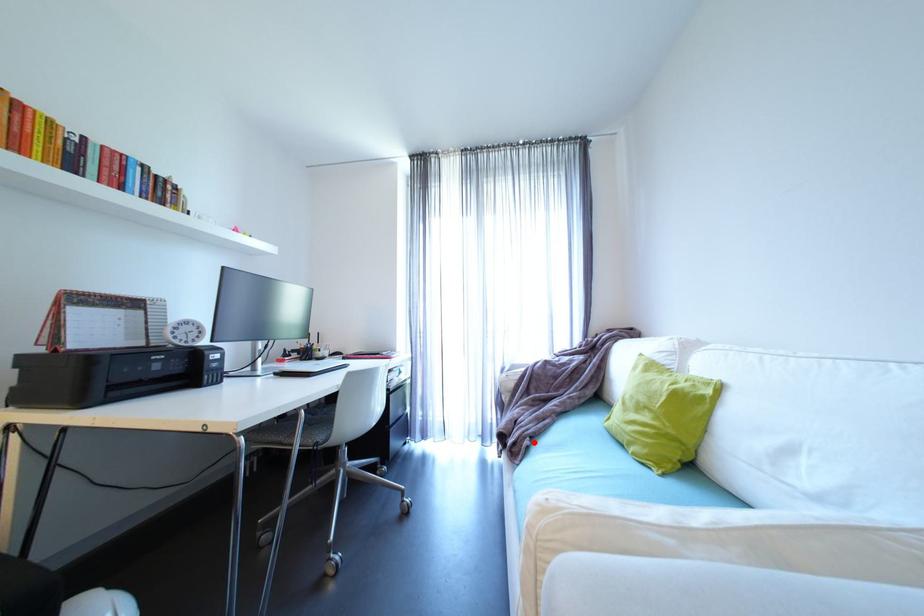
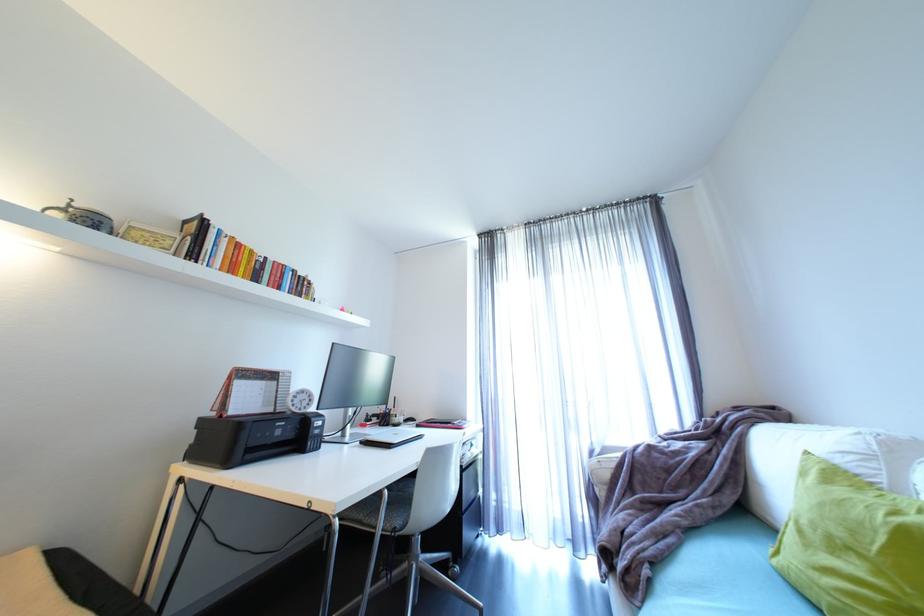
Question: I am providing you with two images of the same scene from different viewpoints. A red point is shown in image1. For the corresponding object point in image2, is it positioned nearer or farther from the camera?

Choices:
 (A) Nearer
 (B) Farther

Answer: (A)